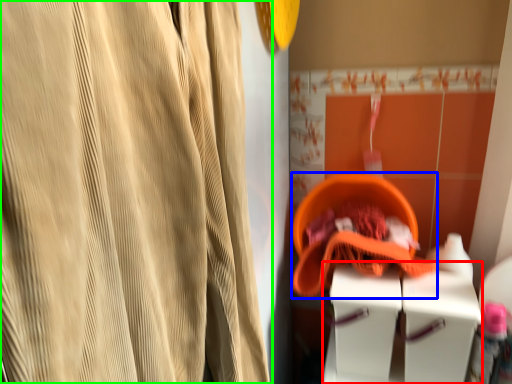
Question: Considering the real-world distances, which object is closest to vanity (highlighted by a red box)? basket (highlighted by a blue box) or curtain (highlighted by a green box).

Choices:
 (A) basket
 (B) curtain

Answer: (A)